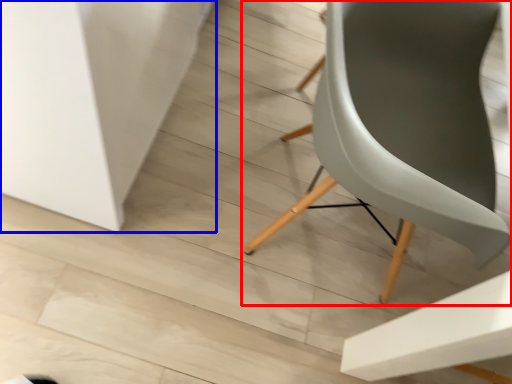
Question: Among these objects, which one is nearest to the camera, chair (highlighted by a red box) or table (highlighted by a blue box)?

Choices:
 (A) chair
 (B) table

Answer: (A)